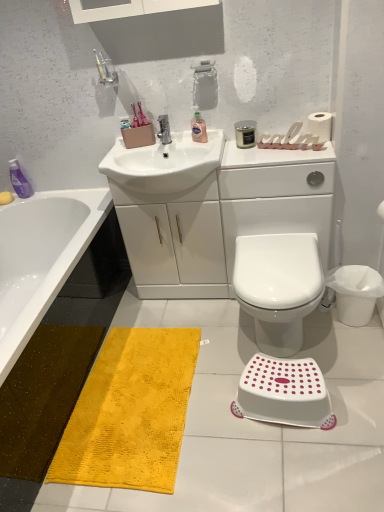
Where is `blank space situated above yellow textured mat at lower left (from a real-world perspective)`? blank space situated above yellow textured mat at lower left (from a real-world perspective) is located at coordinates (140, 390).